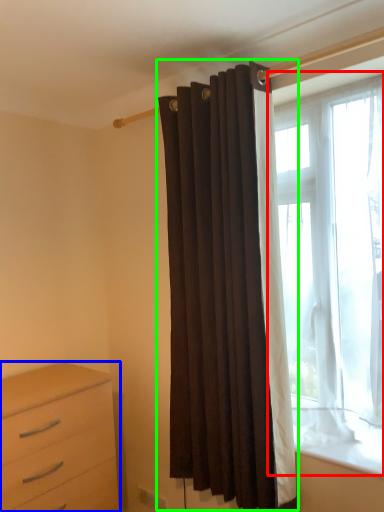
Question: Which is farther away from window (highlighted by a red box)? chest of drawers (highlighted by a blue box) or curtain (highlighted by a green box)?

Choices:
 (A) chest of drawers
 (B) curtain

Answer: (A)